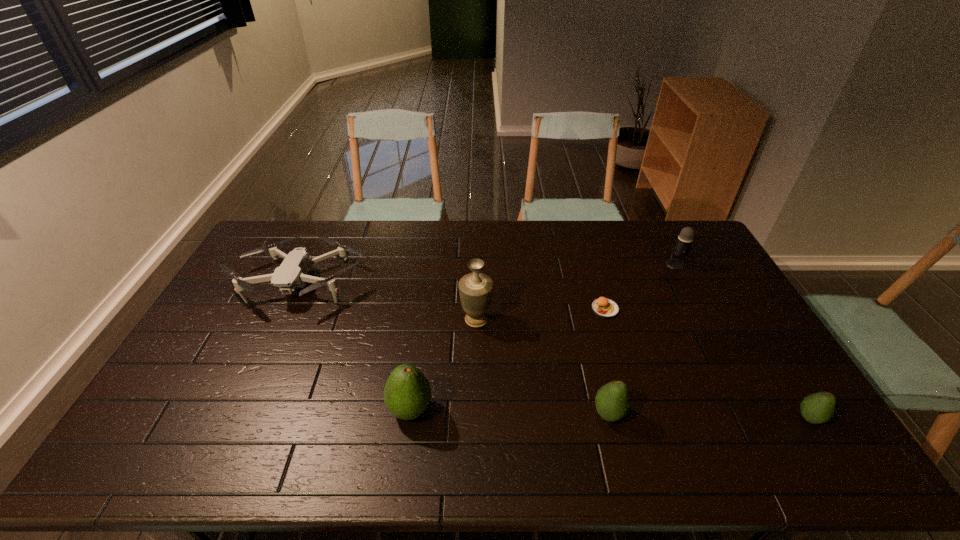
You are a GUI agent. You are given a task and a screenshot of the screen. Output one action in this format:
    pyautogui.click(x=<x>, y=<y>)
    Task: Click on the leftmost avocado
    
    Given the screenshot: What is the action you would take?
    pyautogui.click(x=407, y=393)

What are the coordinates of `the tallest avocado` in the screenshot? It's located at (407, 393).

Identify the location of the second shortest avocado. (612, 402).

I want to click on the rightmost object, so click(x=817, y=408).

Find the location of a particular element. This screenshot has height=540, width=960. the shortest avocado is located at coordinates (817, 408).

Identify the location of the second object from right to left. (683, 245).

This screenshot has height=540, width=960. In order to click on the shortest object in this screenshot , I will do `click(603, 307)`.

Find the location of a particular element. urn is located at coordinates (475, 289).

At what (x,y) coordinates should I click in order to perform the action: click on the third object from left to right. Please return your answer as a coordinate pair (x, y). Image resolution: width=960 pixels, height=540 pixels. Looking at the image, I should click on (475, 289).

The height and width of the screenshot is (540, 960). I want to click on drone, so click(292, 273).